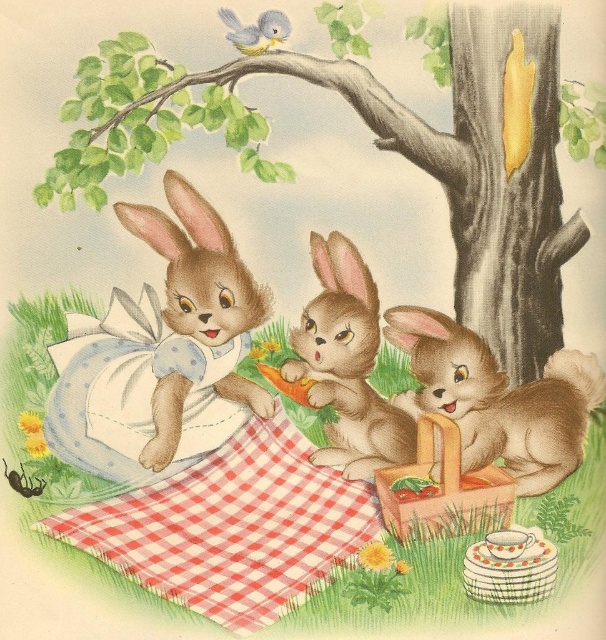
Does red checkered picnic blanket at center appear under soft brown fur rabbit at left?

Correct, red checkered picnic blanket at center is located below soft brown fur rabbit at left.

Is red checkered picnic blanket at center wider than soft brown fur rabbit at left?

Yes, red checkered picnic blanket at center is wider than soft brown fur rabbit at left.

Image resolution: width=606 pixels, height=640 pixels. Describe the element at coordinates (231, 528) in the screenshot. I see `red checkered picnic blanket at center` at that location.

Locate an element on the screen. Image resolution: width=606 pixels, height=640 pixels. red checkered picnic blanket at center is located at coordinates (231, 528).

In the scene shown: Is red checkered picnic blanket at center to the right of fuzzy brown rabbit at lower right from the viewer's perspective?

No, red checkered picnic blanket at center is not to the right of fuzzy brown rabbit at lower right.

Does point (167, 580) lie behind point (462, 412)?

No, it is in front of (462, 412).

Where is `red checkered picnic blanket at center`? Image resolution: width=606 pixels, height=640 pixels. red checkered picnic blanket at center is located at coordinates pos(231,528).

Describe the element at coordinates (393, 150) in the screenshot. Image resolution: width=606 pixels, height=640 pixels. I see `smooth gray bark at center` at that location.

Does smooth gray bark at center appear under soft brown fur rabbit at center?

Actually, smooth gray bark at center is above soft brown fur rabbit at center.

The height and width of the screenshot is (640, 606). Describe the element at coordinates (393, 150) in the screenshot. I see `smooth gray bark at center` at that location.

Where is `smooth gray bark at center`? The image size is (606, 640). smooth gray bark at center is located at coordinates (393, 150).